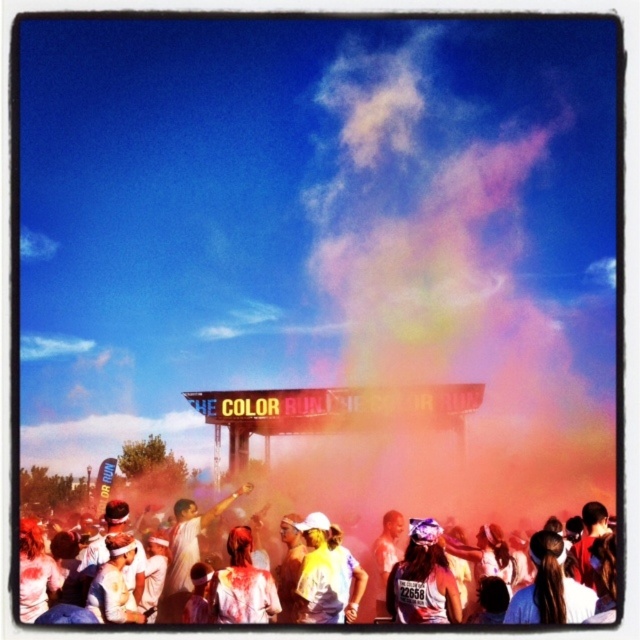
Question: Is white matte shirt at lower center wider than matte white tank top at center?

Choices:
 (A) no
 (B) yes

Answer: (B)

Question: Which point is farther from the camera taking this photo?

Choices:
 (A) (102, 573)
 (B) (451, 621)

Answer: (A)

Question: Can you confirm if white matte shirt at lower center is positioned below matte white tank top at center?

Choices:
 (A) no
 (B) yes

Answer: (A)

Question: Can you confirm if white matte shirt at lower center is wider than matte white tank top at center?

Choices:
 (A) no
 (B) yes

Answer: (B)

Question: Which point is farther to the camera?

Choices:
 (A) white matte shirt at lower center
 (B) matte white tank top at center

Answer: (B)